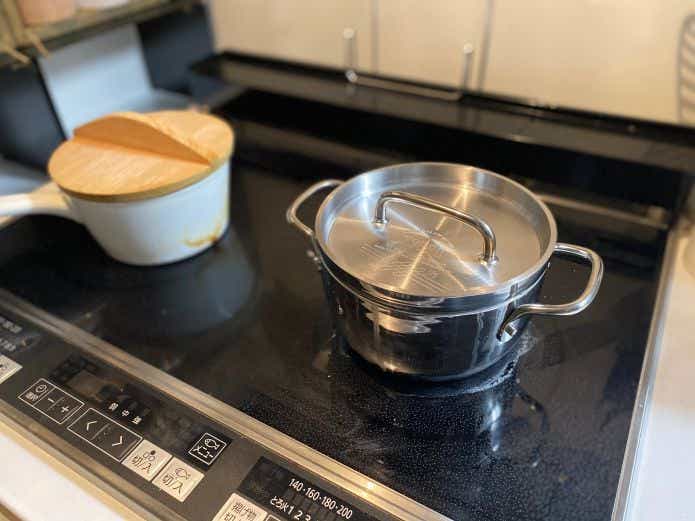
The height and width of the screenshot is (521, 695). Identify the location of lid of the steel pot. (436, 270).